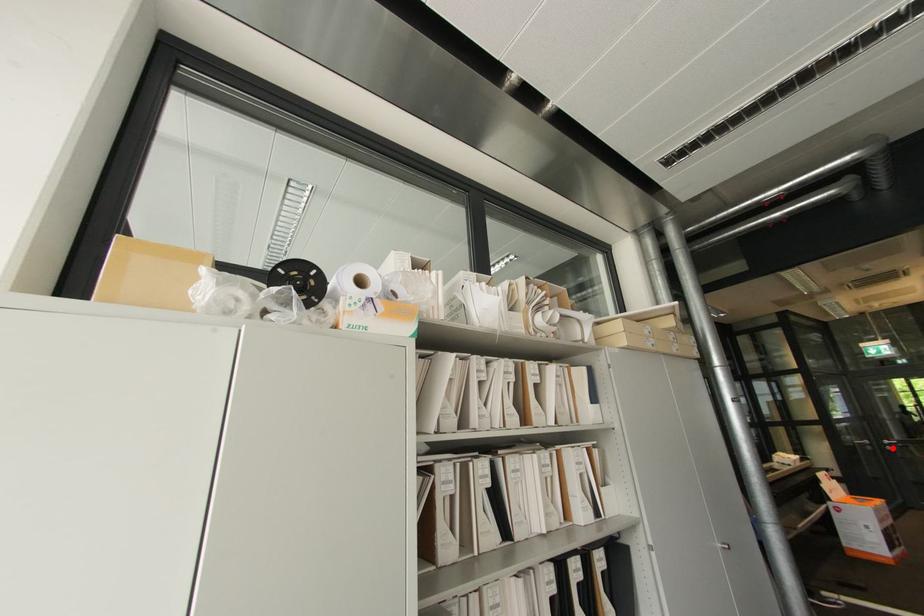
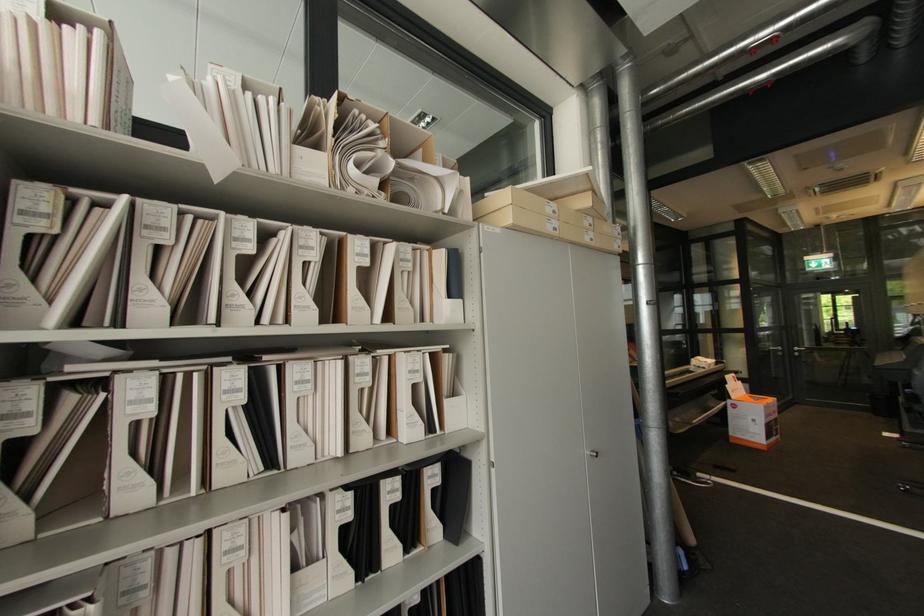
Question: A red point is marked in image1. In image2, is the corresponding 3D point closer to the camera or farther? Reply with the corresponding letter.

Choices:
 (A) The corresponding 3D point is closer.
 (B) The corresponding 3D point is farther.

Answer: (A)